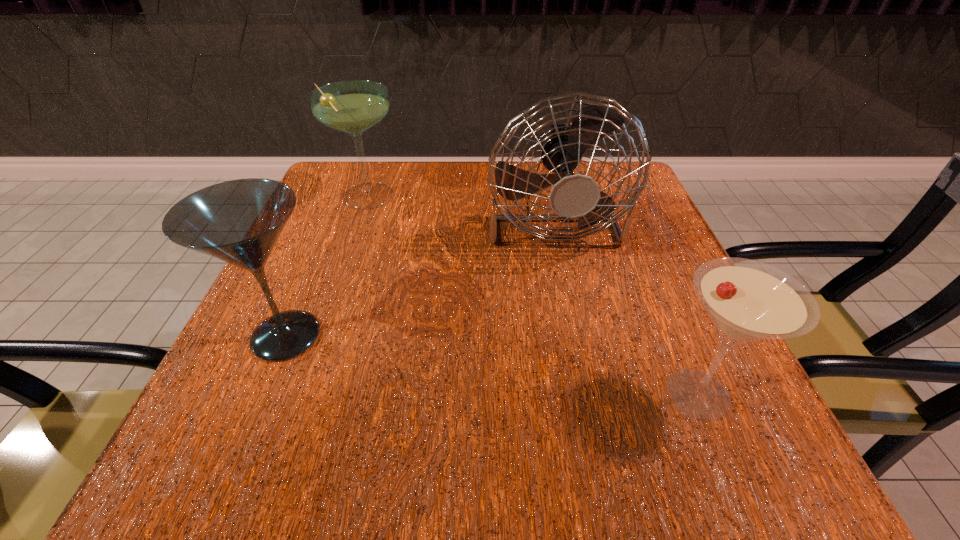
The height and width of the screenshot is (540, 960). Find the location of `fan that is at the right edge`. fan that is at the right edge is located at coordinates (574, 197).

The height and width of the screenshot is (540, 960). I want to click on martini present at the right edge, so click(x=747, y=300).

Find the location of a particular element. Image resolution: width=960 pixels, height=540 pixels. object located in the far left corner section of the desktop is located at coordinates (353, 106).

Find the location of `object that is at the far right corner`. object that is at the far right corner is located at coordinates coord(574,197).

The image size is (960, 540). What are the coordinates of `object present at the near right corner` in the screenshot? It's located at (747, 300).

At what (x,y) coordinates should I click in order to perform the action: click on vacant space at the far edge of the desktop. Please return your answer as a coordinate pair (x, y). This screenshot has height=540, width=960. Looking at the image, I should click on (490, 217).

In the image, there is a desktop. In order to click on vacant space at the near edge in this screenshot , I will do `click(510, 419)`.

Where is `vacant space at the left edge of the desktop`? The width and height of the screenshot is (960, 540). vacant space at the left edge of the desktop is located at coordinates (321, 323).

Identify the location of free space at the right edge of the desktop. (593, 239).

Identify the location of free space at the near left corner of the desktop. (212, 464).